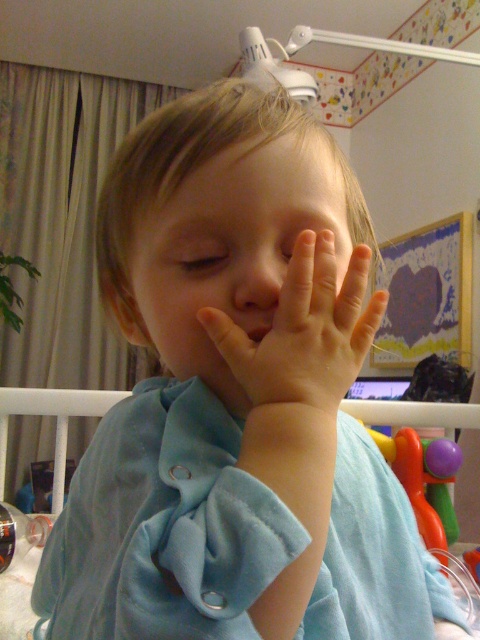
You are a nurse checking on a child in the hospital. You see the smooth flesh hand at center and the blue soft fabric infant bed at center. Which object is wider?

The blue soft fabric infant bed at center is wider than the smooth flesh hand at center.

The child in the image is trying to reach their face with their hand to adjust their hospital gown. Given the distance between the smooth skin face at center and the smooth flesh hand at center, can the child comfortably reach their face without straining?

The smooth skin face at center is 1.10 inches from the smooth flesh hand at center, so the child can comfortably reach their face without straining as the distance is very small.